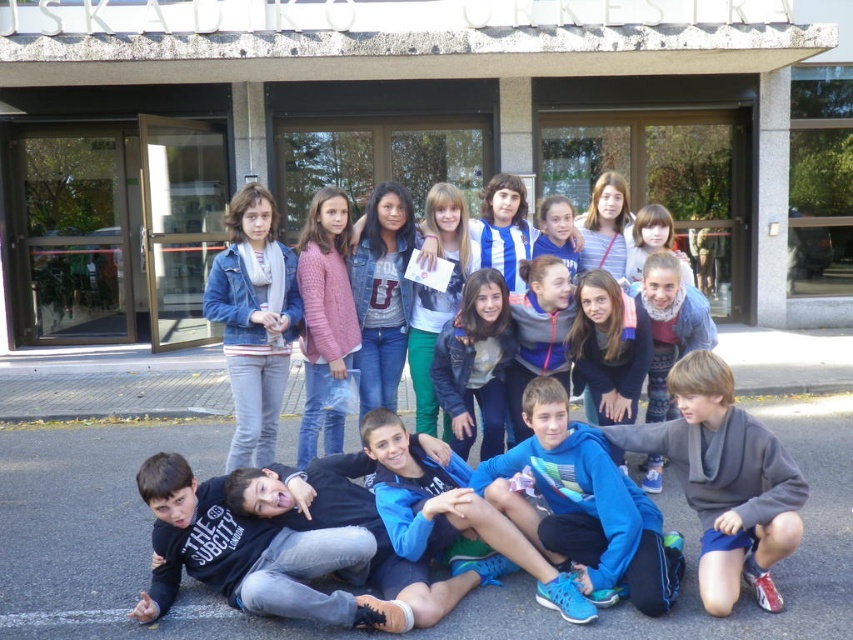
Locate an element on the screen. The height and width of the screenshot is (640, 853). gray fleece jacket at lower right is located at coordinates (724, 481).

Between point (624, 428) and point (241, 193), which one is positioned behind?

The point (241, 193) is behind.

This screenshot has height=640, width=853. Find the location of `gray fleece jacket at lower right`. gray fleece jacket at lower right is located at coordinates (724, 481).